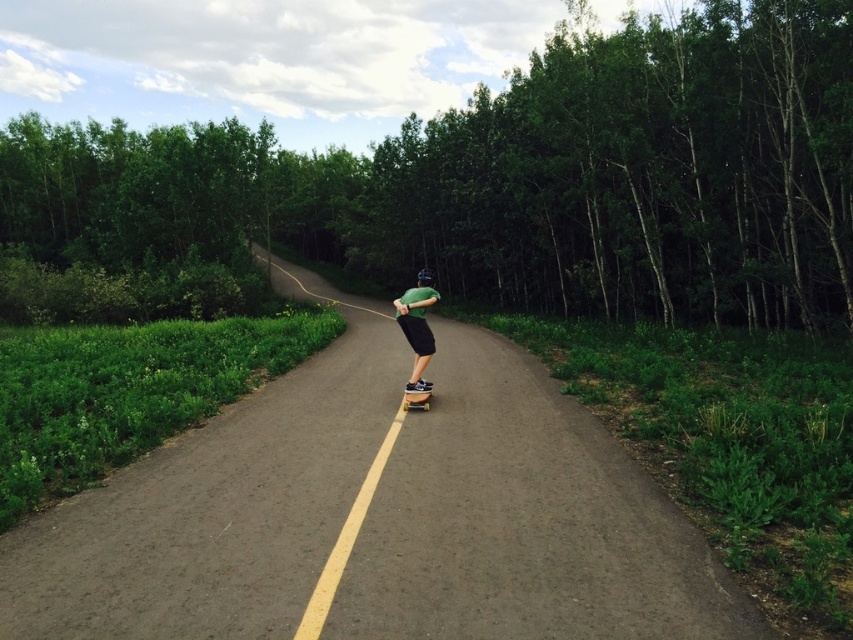
Question: Observing the image, what is the correct spatial positioning of green leafy tree at center in reference to green matte shirt at center?

Choices:
 (A) right
 (B) left

Answer: (B)

Question: Is green leafy tree at center smaller than green matte shirt at center?

Choices:
 (A) no
 (B) yes

Answer: (A)

Question: Which object is the farthest from the wooden skateboard at center?

Choices:
 (A) green leafy tree at center
 (B) green matte shirt at center

Answer: (A)

Question: Observing the image, what is the correct spatial positioning of green matte shirt at center in reference to wooden skateboard at center?

Choices:
 (A) left
 (B) right

Answer: (A)

Question: Which of the following is the closest to the observer?

Choices:
 (A) green leafy tree at center
 (B) green matte shirt at center
 (C) wooden skateboard at center

Answer: (C)

Question: Estimate the real-world distances between objects in this image. Which object is closer to the green matte shirt at center?

Choices:
 (A) wooden skateboard at center
 (B) green leafy tree at center

Answer: (A)